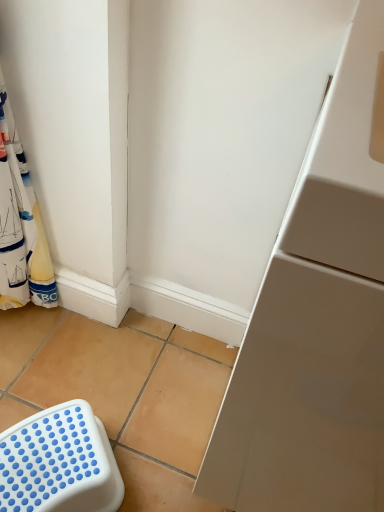
Question: Do you think white plastic stool at lower left is within white fabric laundry at left, or outside of it?

Choices:
 (A) outside
 (B) inside

Answer: (A)

Question: Based on their sizes in the image, would you say white plastic stool at lower left is bigger or smaller than white fabric laundry at left?

Choices:
 (A) big
 (B) small

Answer: (B)

Question: From the image's perspective, is white plastic stool at lower left above or below white fabric laundry at left?

Choices:
 (A) above
 (B) below

Answer: (B)

Question: Considering the positions of white fabric laundry at left and white plastic stool at lower left in the image, is white fabric laundry at left taller or shorter than white plastic stool at lower left?

Choices:
 (A) tall
 (B) short

Answer: (A)

Question: From a real-world perspective, relative to white plastic stool at lower left, is white fabric laundry at left vertically above or below?

Choices:
 (A) above
 (B) below

Answer: (A)

Question: Is point (14, 170) closer or farther from the camera than point (104, 496)?

Choices:
 (A) farther
 (B) closer

Answer: (A)

Question: From the image's perspective, is white fabric laundry at left located above or below white plastic stool at lower left?

Choices:
 (A) above
 (B) below

Answer: (A)